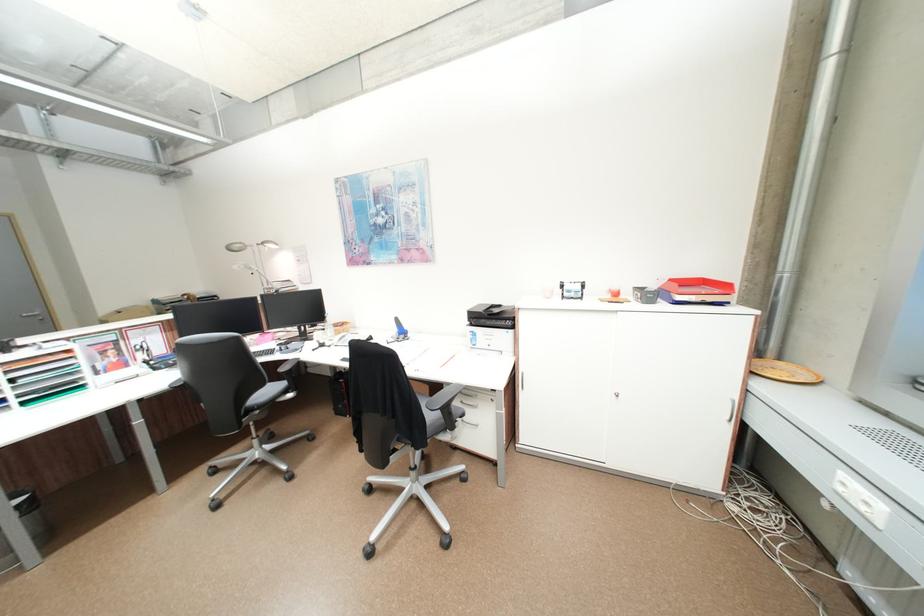
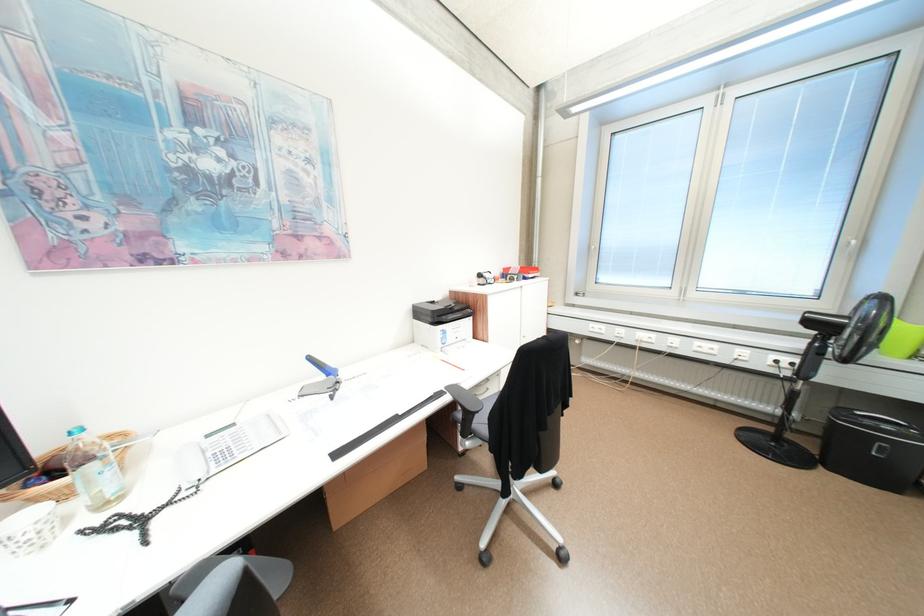
Locate, in the second image, the point that corresponds to point 407,320 in the first image.

(320, 359)